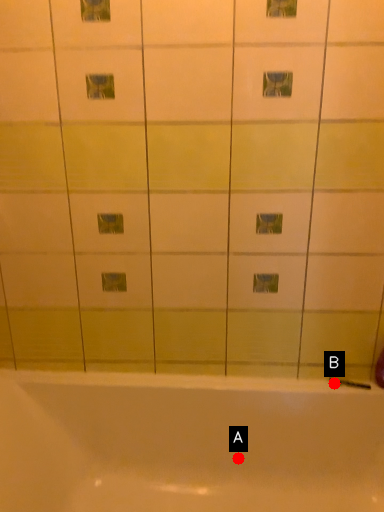
Question: Two points are circled on the image, labeled by A and B beside each circle. Which point appears farthest from the camera in this image?

Choices:
 (A) A is further
 (B) B is further

Answer: (A)